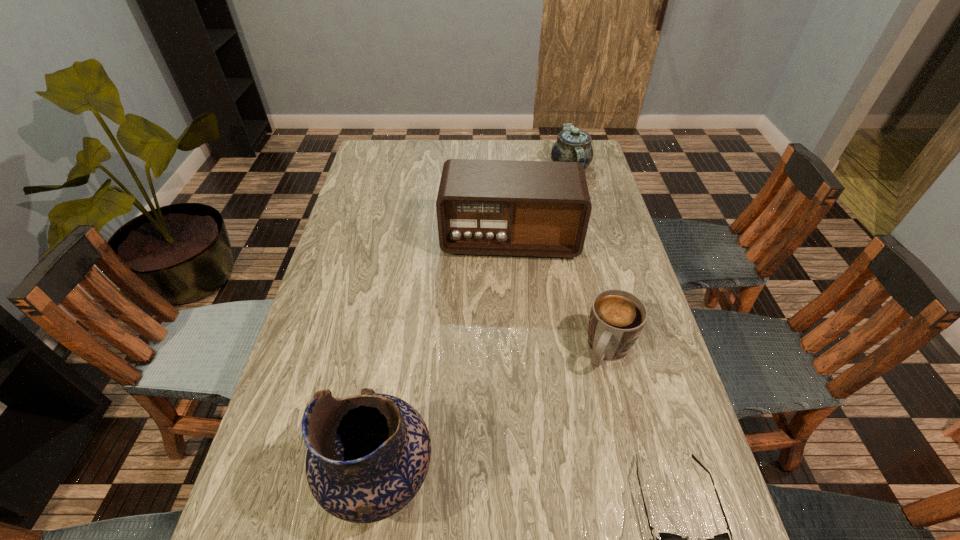
Image resolution: width=960 pixels, height=540 pixels. In order to click on vacant space that satisfies the following two spatial constraints: 1. on the back side of the third farthest object; 2. on the right side of the chinaware in this screenshot , I will do `click(564, 167)`.